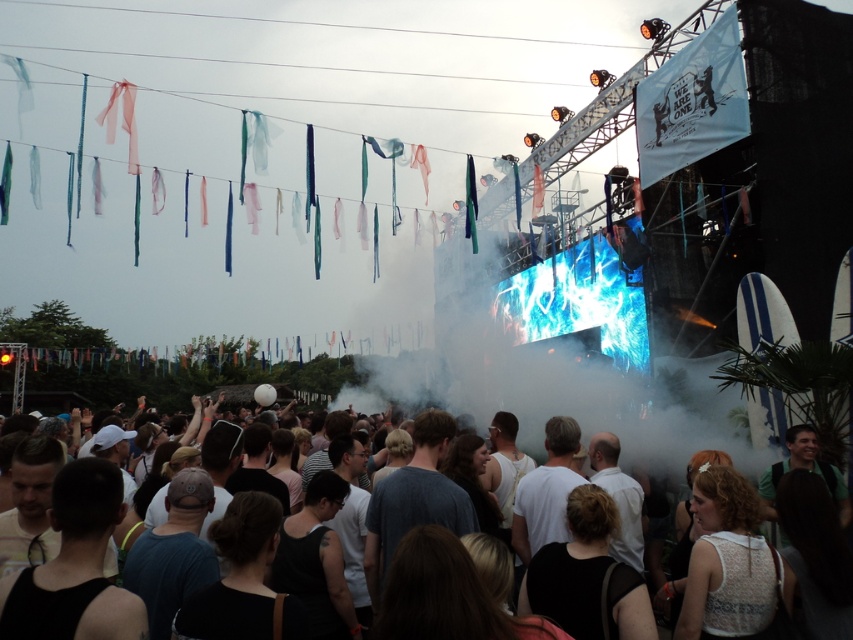
You are a photographer at the concert trying to capture the stage. You notice the white fog at center and the dark gray cotton crowd at lower center. Which object is closer to the stage?

The dark gray cotton crowd at lower center is closer to the stage because the white fog at center is located above it, meaning the crowd is beneath the fog and thus nearer to the stage.